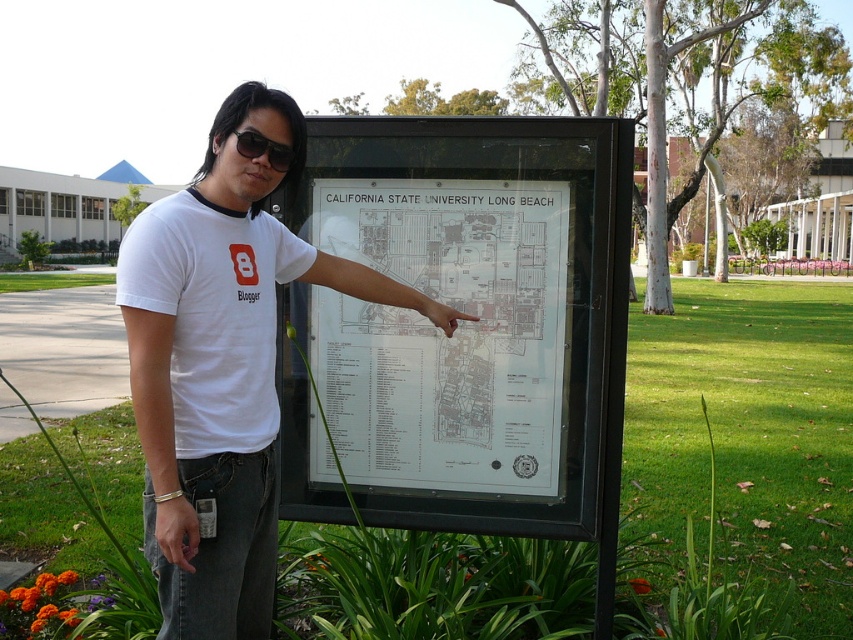
Is white paper map at center positioned before black plastic goggles at upper center?

No, white paper map at center is further to the viewer.

Who is more forward, (541, 397) or (250, 148)?

Point (250, 148) is in front.

Where is `white paper map at center`? white paper map at center is located at coordinates (444, 336).

Is white t-shirt at center thinner than black plastic goggles at upper center?

In fact, white t-shirt at center might be wider than black plastic goggles at upper center.

Based on the photo, is white t-shirt at center below black plastic goggles at upper center?

Yes.

I want to click on white t-shirt at center, so click(222, 368).

You are a GUI agent. You are given a task and a screenshot of the screen. Output one action in this format:
    pyautogui.click(x=<x>, y=<y>)
    Task: Click on the white t-shirt at center
    
    Given the screenshot: What is the action you would take?
    pyautogui.click(x=222, y=368)

Which is more to the right, white t-shirt at center or white paper map at center?

Positioned to the right is white paper map at center.

At what (x,y) coordinates should I click in order to perform the action: click on white t-shirt at center. Please return your answer as a coordinate pair (x, y). This screenshot has width=853, height=640. Looking at the image, I should click on (222, 368).